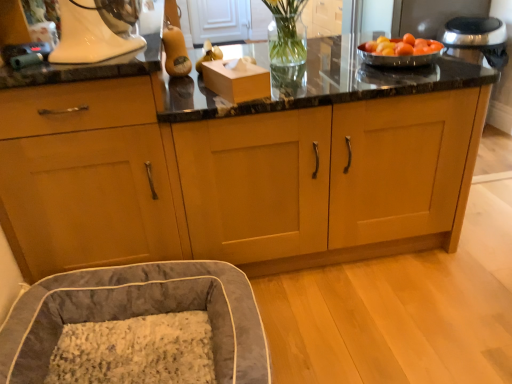
Question: From their relative heights in the image, would you say velvet gray bean bag at lower left is taller or shorter than matte wood cabinet at lower left, which appears as the 2th cabinetry when viewed from the right?

Choices:
 (A) tall
 (B) short

Answer: (B)

Question: Is velvet gray bean bag at lower left situated inside matte wood cabinet at lower left, which appears as the 2th cabinetry when viewed from the right, or outside?

Choices:
 (A) outside
 (B) inside

Answer: (A)

Question: Estimate the real-world distances between objects in this image. Which object is farther from the velvet gray bean bag at lower left?

Choices:
 (A) matte wood cabinet at lower left, which appears as the 2th cabinetry when viewed from the right
 (B) silver metallic bowl at upper right
 (C) white glossy stand mixer at upper left
 (D) matte wood cabinets at center, the 2th cabinetry when ordered from left to right

Answer: (B)

Question: Estimate the real-world distances between objects in this image. Which object is farther from the matte wood cabinets at center, the 1th cabinetry in the right-to-left sequence?

Choices:
 (A) matte wood cabinet at lower left, which appears as the 2th cabinetry when viewed from the right
 (B) white glossy stand mixer at upper left
 (C) silver metallic bowl at upper right
 (D) velvet gray bean bag at lower left

Answer: (C)